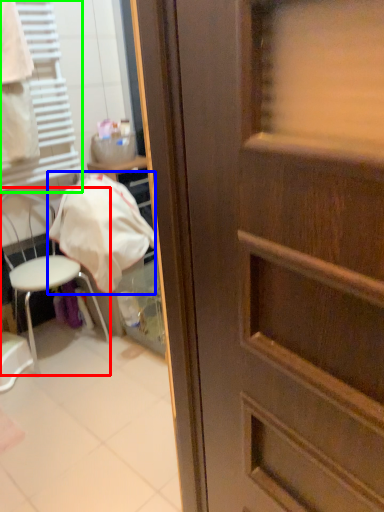
Question: Considering the real-world distances, which object is closest to chair (highlighted by a red box)? blanket (highlighted by a blue box) or shutter (highlighted by a green box).

Choices:
 (A) blanket
 (B) shutter

Answer: (A)